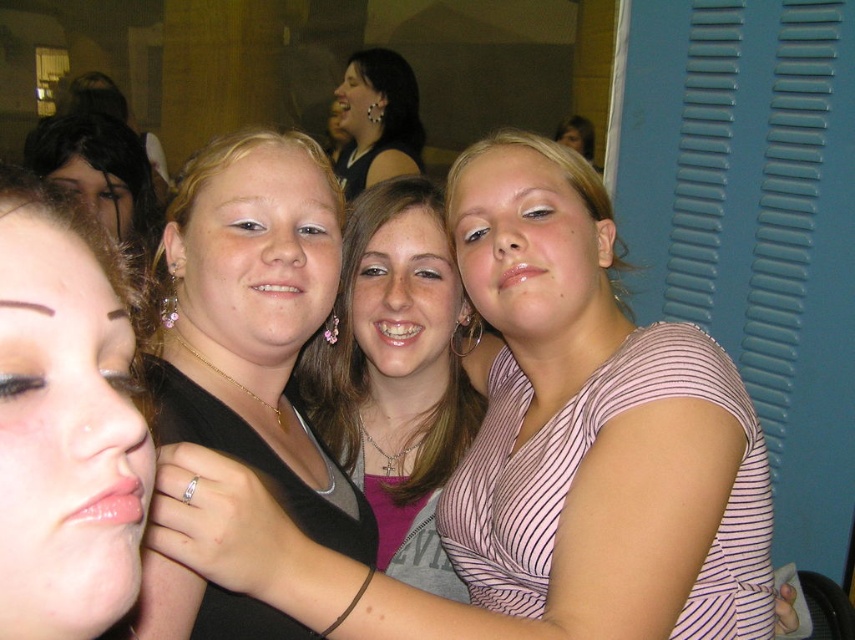
Who is higher up, pink striped shirt at center or matte black top at upper center?

matte black top at upper center is higher up.

Does pink striped shirt at center have a smaller size compared to matte black top at upper center?

No, pink striped shirt at center is not smaller than matte black top at upper center.

I want to click on pink striped shirt at center, so click(594, 536).

Where is `matte black hair at left`? The width and height of the screenshot is (855, 640). matte black hair at left is located at coordinates (65, 422).

Between point (107, 401) and point (349, 164), which one is positioned behind?

Point (349, 164)

Locate an element on the screen. The image size is (855, 640). matte black hair at left is located at coordinates (65, 422).

Looking at this image, does pink striped shirt at center have a smaller size compared to matte black hair at left?

Incorrect, pink striped shirt at center is not smaller in size than matte black hair at left.

Which is below, pink striped shirt at center or matte black hair at left?

pink striped shirt at center is lower down.

Identify the location of pink striped shirt at center. (594, 536).

I want to click on pink striped shirt at center, so click(x=594, y=536).